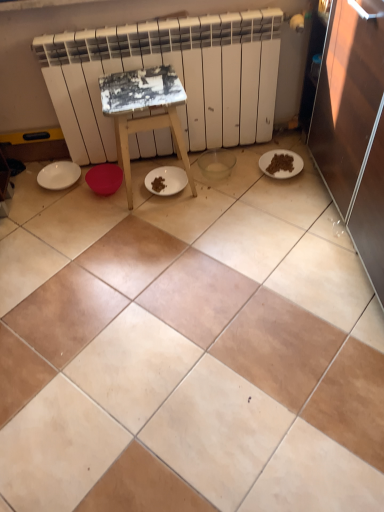
This screenshot has height=512, width=384. Identify the location of vacant space in front of white matte plate at lower right, the 1th paper plate when ordered from right to left. pyautogui.click(x=284, y=195).